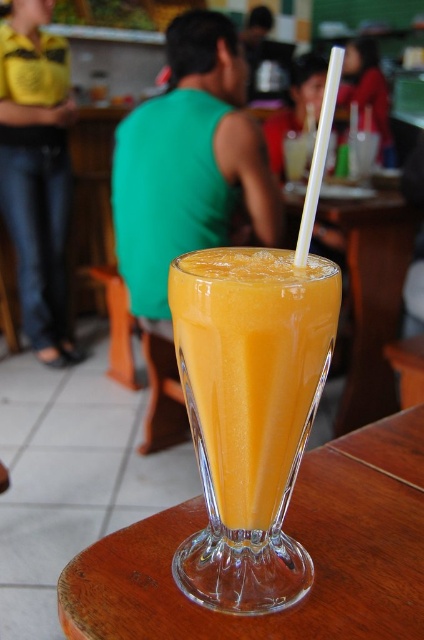
Question: Which of the following is the closest to the observer?

Choices:
 (A) (27, 220)
 (B) (300, 241)
 (C) (385, 148)
 (D) (279, 456)

Answer: (B)

Question: Considering the real-world distances, which object is farthest from the transparent glass at center?

Choices:
 (A) transparent wood table at center
 (B) matte black phone at upper right
 (C) orange smoothie at center

Answer: (C)

Question: Which of these objects is positioned closest to the matte black phone at upper right?

Choices:
 (A) orange smoothie at center
 (B) transparent glass at center
 (C) matte yellow shirt at left

Answer: (B)

Question: Does transparent glass at center have a smaller size compared to matte black phone at upper right?

Choices:
 (A) yes
 (B) no

Answer: (B)

Question: Does transparent wood table at center have a greater width compared to green fabric shirt at center?

Choices:
 (A) no
 (B) yes

Answer: (A)

Question: Can you confirm if matte black phone at upper right is positioned below white plastic straw at upper center?

Choices:
 (A) yes
 (B) no

Answer: (B)